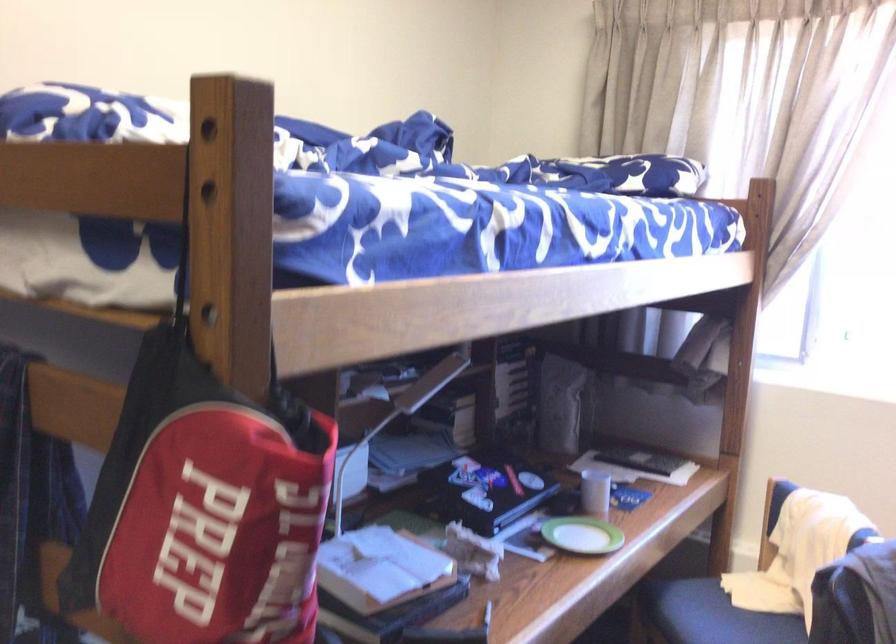
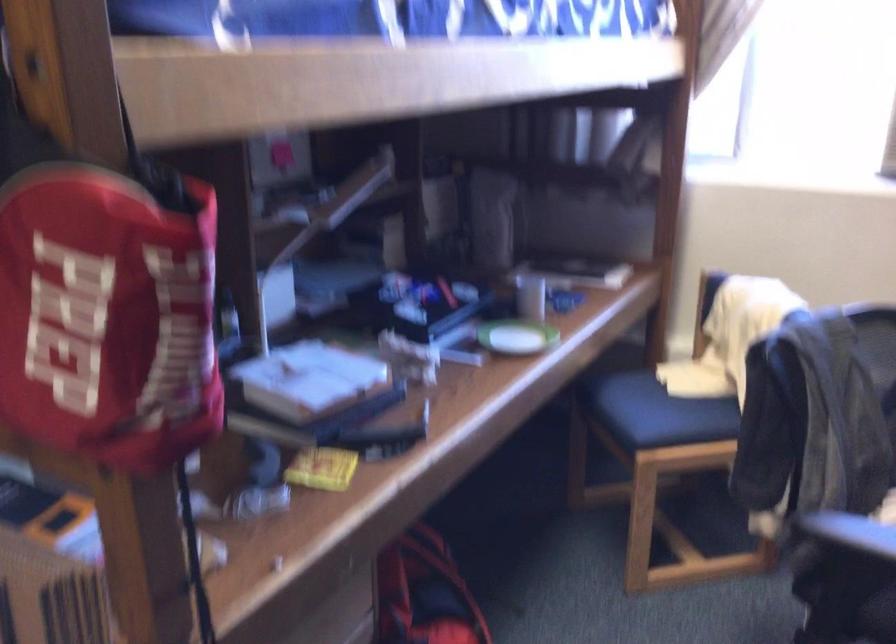
Locate, in the second image, the point that corresponds to the point at 597,491 in the first image.

(530, 297)